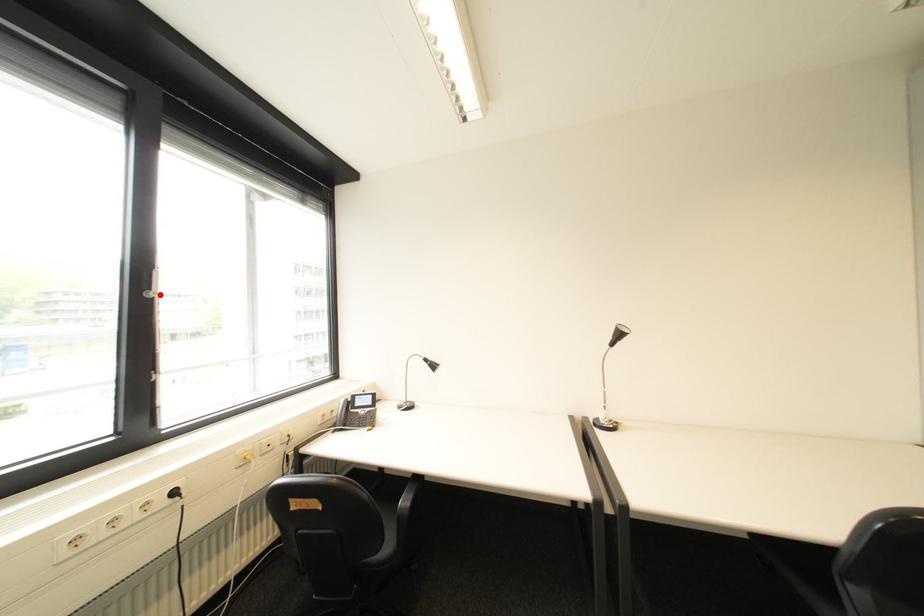
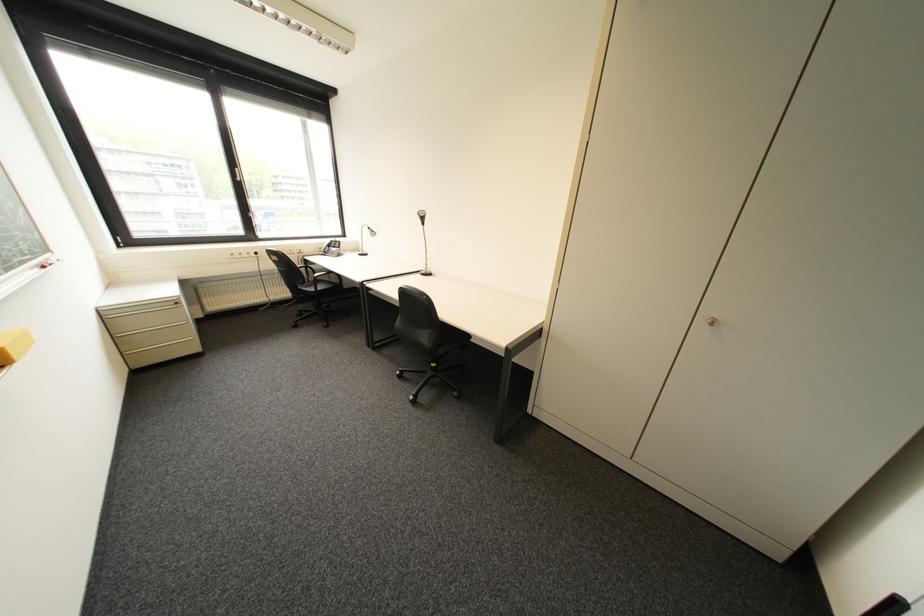
Locate, in the second image, the point that corresponds to the highlighted location in the first image.

(249, 180)